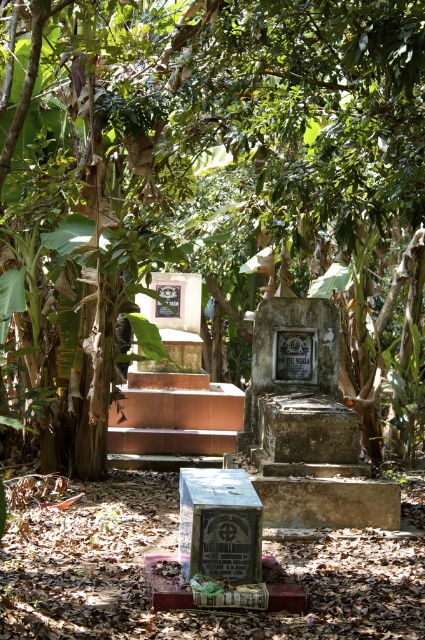
Question: Can you confirm if green leafy tree at center is thinner than brown concrete stairs at center?

Choices:
 (A) no
 (B) yes

Answer: (A)

Question: Is green leafy tree at center smaller than metallic stone gravestone at center?

Choices:
 (A) yes
 (B) no

Answer: (B)

Question: Which of these objects is positioned farthest from the metallic stone gravestone at center?

Choices:
 (A) brown concrete stairs at center
 (B) matte black plaque at center
 (C) weathered stone plaque at center
 (D) green leafy tree at center

Answer: (D)

Question: Is weathered stone plaque at center wider than matte black plaque at center?

Choices:
 (A) no
 (B) yes

Answer: (B)

Question: Which of the following is the farthest from the observer?

Choices:
 (A) green leafy tree at center
 (B) brown concrete stairs at center
 (C) matte black plaque at center

Answer: (B)

Question: Which point appears farthest from the camera in this image?

Choices:
 (A) (237, 550)
 (B) (277, 460)
 (C) (336, 288)
 (D) (187, 392)

Answer: (D)